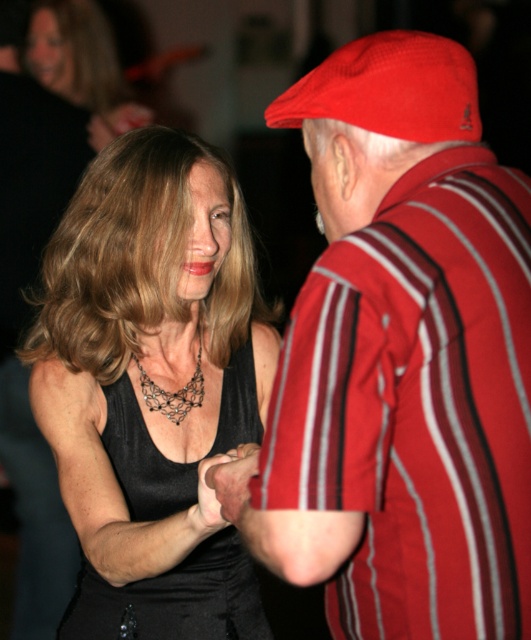
The width and height of the screenshot is (531, 640). Describe the element at coordinates (82, 65) in the screenshot. I see `matte black dress at center` at that location.

Is matte black dress at center smaller than black lace necklace at center?

Incorrect, matte black dress at center is not smaller in size than black lace necklace at center.

What do you see at coordinates (82, 65) in the screenshot? The width and height of the screenshot is (531, 640). I see `matte black dress at center` at bounding box center [82, 65].

Find the location of `matte black dress at center`. matte black dress at center is located at coordinates (82, 65).

Can you confirm if black silk dress at center is bigger than matte black dress at center?

No, black silk dress at center is not bigger than matte black dress at center.

Who is more forward, (172, 486) or (89, 1)?

Point (172, 486)

The height and width of the screenshot is (640, 531). What do you see at coordinates (157, 385) in the screenshot? I see `black silk dress at center` at bounding box center [157, 385].

The image size is (531, 640). I want to click on black silk dress at center, so click(157, 385).

Who is more forward, (216, 436) or (75, 624)?

Point (75, 624) is in front.

Who is positioned more to the right, black silk dress at center or black satin dress at center?

black satin dress at center is more to the right.

What do you see at coordinates (157, 385) in the screenshot? I see `black silk dress at center` at bounding box center [157, 385].

Image resolution: width=531 pixels, height=640 pixels. Find the location of `black silk dress at center`. black silk dress at center is located at coordinates (157, 385).